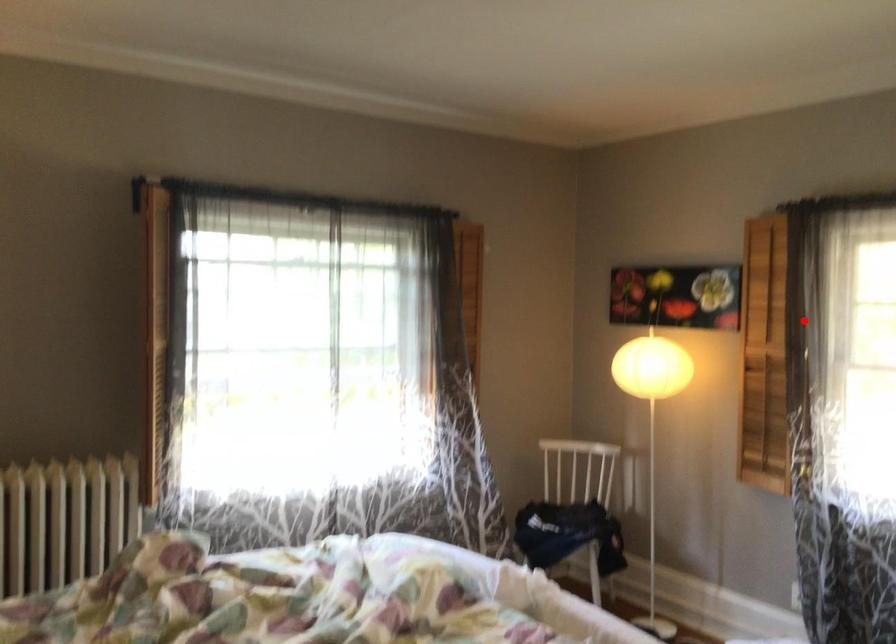
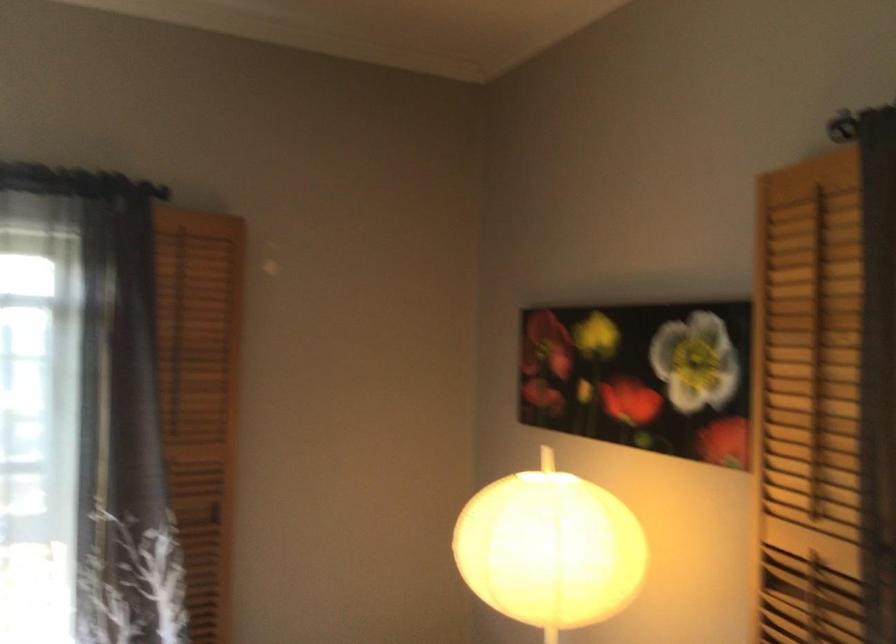
Locate, in the second image, the point that corresponds to the highlighted location in the first image.

(876, 482)